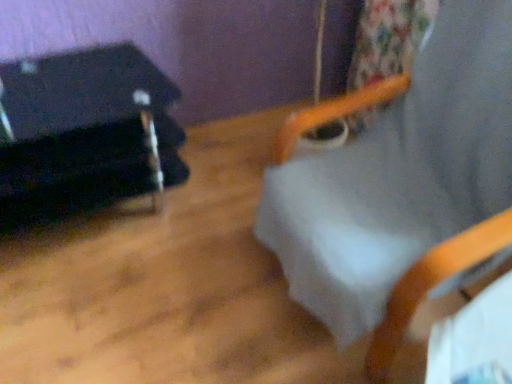
In order to click on free space to the left of white fabric beach chair at upper center in this screenshot , I will do coord(190,287).